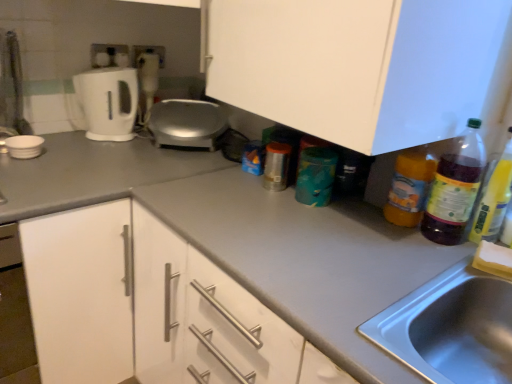
Question: Is translucent plastic bottle at right, placed as the first bottle when sorted from left to right, wider than white matte cabinet at center?

Choices:
 (A) yes
 (B) no

Answer: (B)

Question: From a real-world perspective, does translucent plastic bottle at right, which appears as the 2th bottle when viewed from the right, stand above white matte cabinet at center?

Choices:
 (A) yes
 (B) no

Answer: (B)

Question: Does translucent plastic bottle at right, placed as the first bottle when sorted from left to right, turn towards white matte cabinet at center?

Choices:
 (A) no
 (B) yes

Answer: (A)

Question: Can you confirm if translucent plastic bottle at right, which appears as the 2th bottle when viewed from the right, is bigger than white matte cabinet at center?

Choices:
 (A) no
 (B) yes

Answer: (A)

Question: Is the position of translucent plastic bottle at right, which appears as the 2th bottle when viewed from the right, less distant than that of white matte cabinet at center?

Choices:
 (A) no
 (B) yes

Answer: (A)

Question: Is white plastic blender at upper left in front of or behind white matte bowl at left, the first appliance in the left-to-right sequence, in the image?

Choices:
 (A) behind
 (B) front

Answer: (A)

Question: From the image's perspective, is white plastic blender at upper left above or below white matte bowl at left, which is the second appliance from right to left?

Choices:
 (A) below
 (B) above

Answer: (B)

Question: Looking at the image, does white plastic blender at upper left seem bigger or smaller compared to white matte bowl at left, the 1th appliance in the front-to-back sequence?

Choices:
 (A) small
 (B) big

Answer: (B)

Question: From their relative heights in the image, would you say white plastic blender at upper left is taller or shorter than white matte bowl at left, the 1th appliance in the front-to-back sequence?

Choices:
 (A) short
 (B) tall

Answer: (B)

Question: Do you think white matte cabinet at center is within translucent plastic bottle at right, the 1th bottle viewed from the right, or outside of it?

Choices:
 (A) inside
 (B) outside

Answer: (B)

Question: In terms of size, does white matte cabinet at center appear bigger or smaller than translucent plastic bottle at right, which appears as the second bottle when viewed from the left?

Choices:
 (A) small
 (B) big

Answer: (B)

Question: In the image, is white matte cabinet at center on the left side or the right side of translucent plastic bottle at right, which appears as the second bottle when viewed from the left?

Choices:
 (A) right
 (B) left

Answer: (B)

Question: Considering the positions of point (445, 6) and point (481, 203), is point (445, 6) closer or farther from the camera than point (481, 203)?

Choices:
 (A) farther
 (B) closer

Answer: (B)

Question: Would you say translucent plastic bottle at right, which appears as the 2th bottle when viewed from the right, is inside or outside white matte bowl at left, which is the second appliance from right to left?

Choices:
 (A) inside
 (B) outside

Answer: (B)

Question: Does point (387, 215) appear closer or farther from the camera than point (6, 142)?

Choices:
 (A) closer
 (B) farther

Answer: (A)